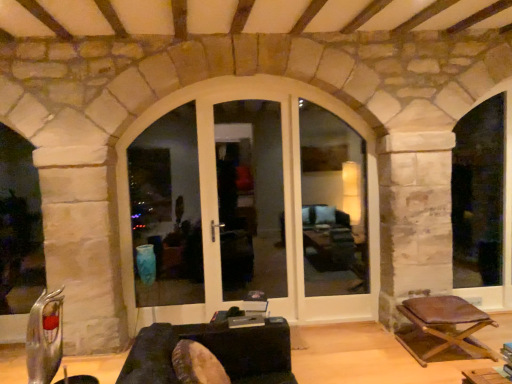
Where is `vacant region below brown leather stool at lower right (from a real-world perspective)`? This screenshot has width=512, height=384. vacant region below brown leather stool at lower right (from a real-world perspective) is located at coordinates (447, 357).